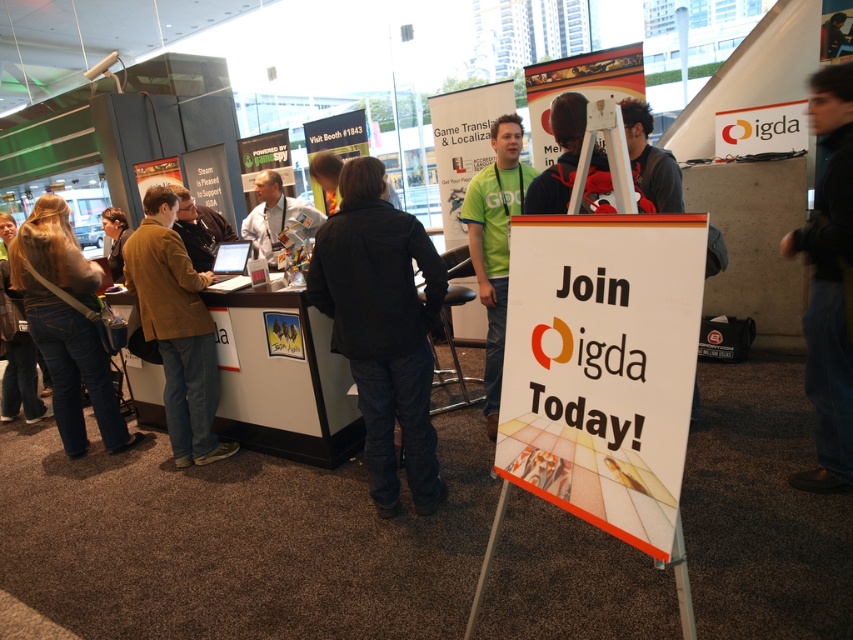
You are an attendee at the event and want to locate the IGDA booth. You see the white paper sign at center and the brown leather jacket at left. Which object takes up more space in the image?

The brown leather jacket at left takes up more space in the image than the white paper sign at center because the white paper sign at center occupies less space than brown leather jacket at left.